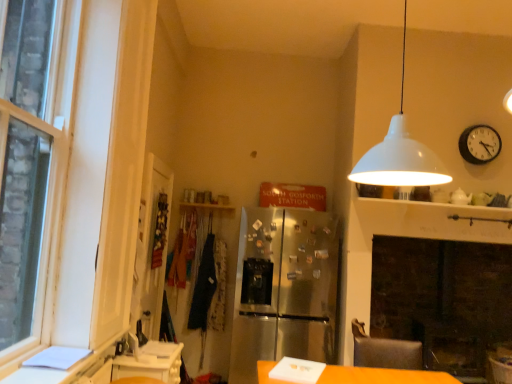
Where is `free location above black matte clock at upper right (from a real-world perspective)`? Image resolution: width=512 pixels, height=384 pixels. free location above black matte clock at upper right (from a real-world perspective) is located at coordinates (478, 126).